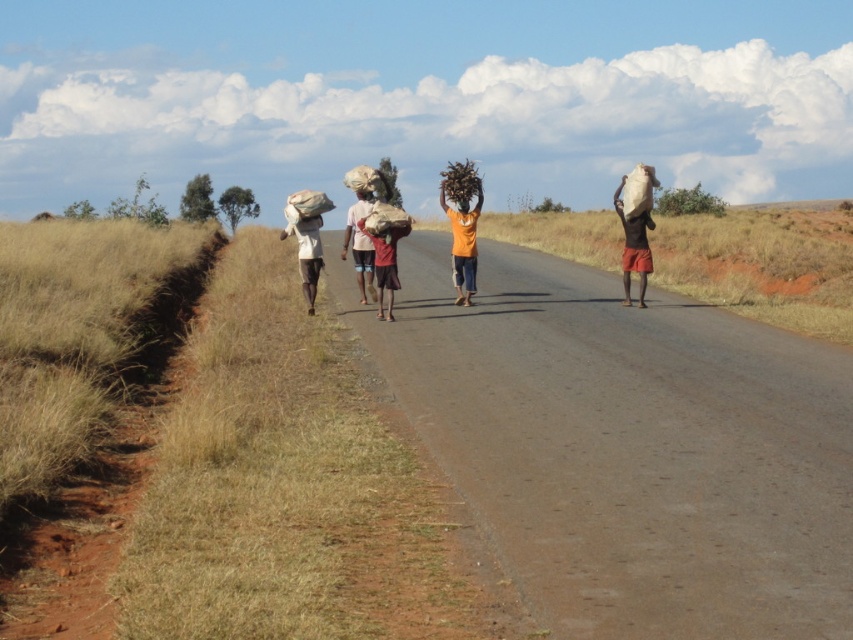
What do you see at coordinates (306, 236) in the screenshot? I see `white fabric bag at center` at bounding box center [306, 236].

Who is shorter, white fabric bag at center or brown fabric sack at center?

brown fabric sack at center is shorter.

Is point (311, 248) positioned before point (387, 300)?

No, (311, 248) is further to viewer.

Identify the location of white fabric bag at center. (306, 236).

Who is positioned more to the right, white fabric bag at center or orange matte shirt at center?

Positioned to the right is orange matte shirt at center.

Does white fabric bag at center have a lesser width compared to orange matte shirt at center?

Incorrect, white fabric bag at center's width is not less than orange matte shirt at center's.

Is point (299, 248) closer to viewer compared to point (469, 282)?

Yes, point (299, 248) is in front of point (469, 282).

Locate an element on the screen. white fabric bag at center is located at coordinates (306, 236).

Who is higher up, white fabric bag at center or matte brown bag at right?

matte brown bag at right is higher up.

Is white fabric bag at center taller than matte brown bag at right?

In fact, white fabric bag at center may be shorter than matte brown bag at right.

Between point (317, 230) and point (646, 250), which one is positioned behind?

The point (646, 250) is behind.

Locate an element on the screen. white fabric bag at center is located at coordinates (306, 236).